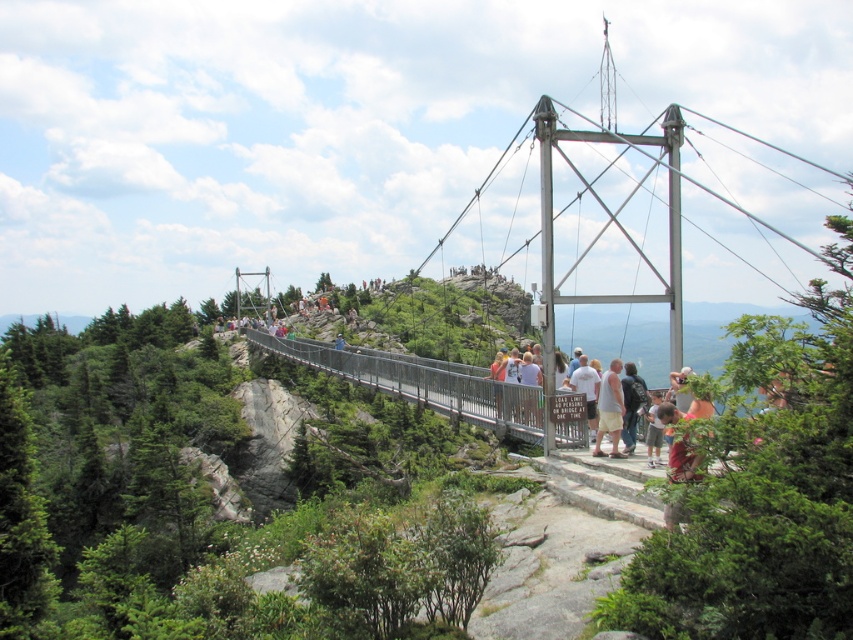
Is camouflage shirt at lower right wider than light beige shorts at center?

Indeed, camouflage shirt at lower right has a greater width compared to light beige shorts at center.

Does camouflage shirt at lower right have a greater height compared to light beige shorts at center?

No.

This screenshot has height=640, width=853. What are the coordinates of `camouflage shirt at lower right` in the screenshot? It's located at (682, 461).

Is light beige shorts at center taller than white t-shirt at center?

Correct, light beige shorts at center is much taller as white t-shirt at center.

How distant is light beige shorts at center from white t-shirt at center?

A distance of 2.12 meters exists between light beige shorts at center and white t-shirt at center.

Describe the element at coordinates (610, 410) in the screenshot. I see `light beige shorts at center` at that location.

The width and height of the screenshot is (853, 640). Identify the location of light beige shorts at center. (610, 410).

Is camouflage shirt at lower right above white t-shirt at center?

Actually, camouflage shirt at lower right is below white t-shirt at center.

Does point (682, 476) come closer to viewer compared to point (589, 396)?

Yes, point (682, 476) is closer to viewer.

Does point (675, 451) come farther from viewer compared to point (579, 362)?

No, it is not.

I want to click on camouflage shirt at lower right, so click(x=682, y=461).